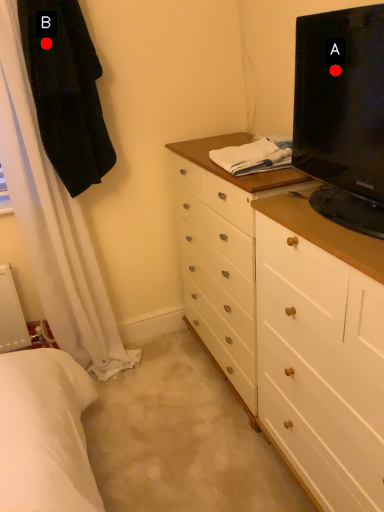
Question: Two points are circled on the image, labeled by A and B beside each circle. Which point appears closest to the camera in this image?

Choices:
 (A) A is closer
 (B) B is closer

Answer: (A)